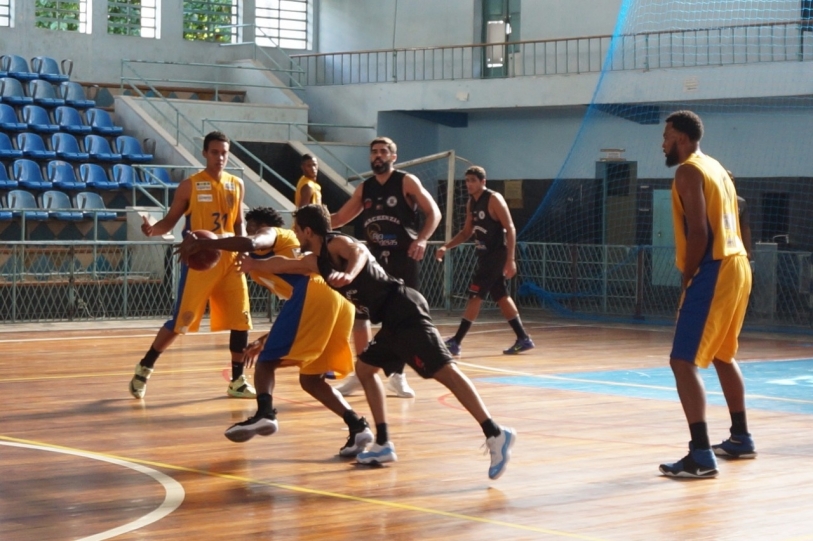
This screenshot has height=541, width=813. In order to click on windows in this screenshot , I will do `click(279, 22)`, `click(190, 14)`, `click(129, 10)`, `click(38, 18)`.